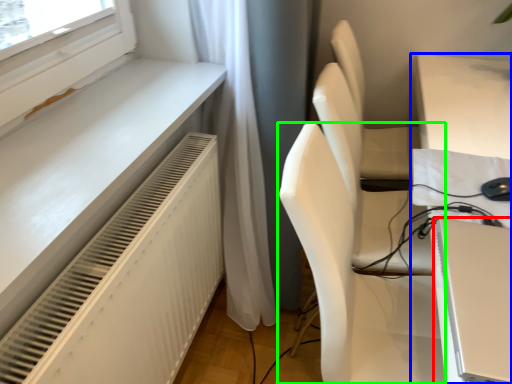
Question: Considering the real-world distances, which object is farthest from computer (highlighted by a red box)? table (highlighted by a blue box) or chair (highlighted by a green box)?

Choices:
 (A) table
 (B) chair

Answer: (A)